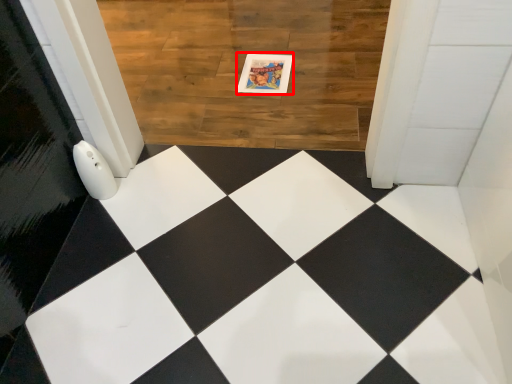
Question: Where is postcard (annotated by the red box) located in relation to square in the image?

Choices:
 (A) right
 (B) left

Answer: (A)